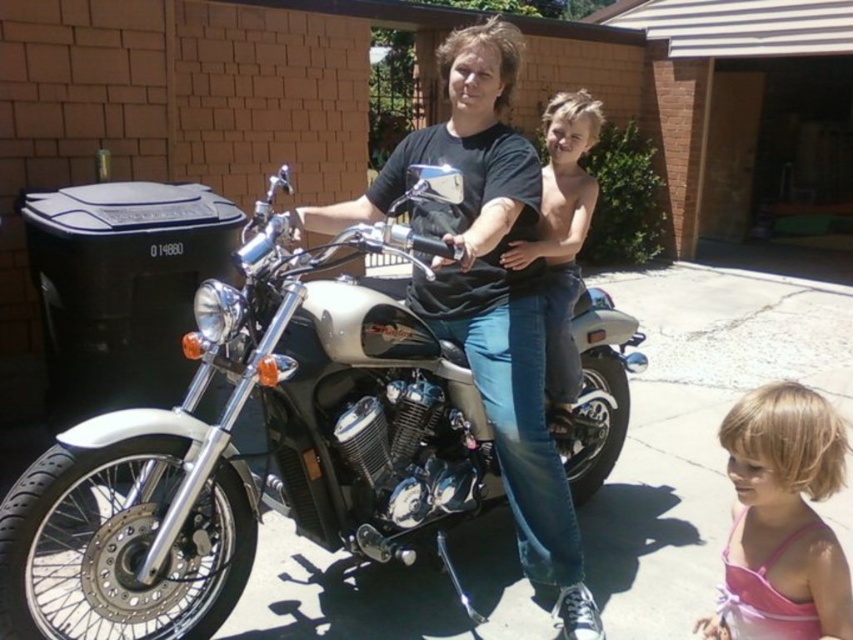
Does white metallic motorcycle at center have a greater width compared to shiny blonde hair at center?

Correct, the width of white metallic motorcycle at center exceeds that of shiny blonde hair at center.

Is white metallic motorcycle at center taller than shiny blonde hair at center?

Indeed, white metallic motorcycle at center has a greater height compared to shiny blonde hair at center.

Image resolution: width=853 pixels, height=640 pixels. What are the coordinates of `white metallic motorcycle at center` in the screenshot? It's located at (265, 444).

At what (x,y) coordinates should I click in order to perform the action: click on white metallic motorcycle at center. Please return your answer as a coordinate pair (x, y). Looking at the image, I should click on (265, 444).

Between black matte shirt at center and pink fabric dress at lower right, which one appears on the right side from the viewer's perspective?

pink fabric dress at lower right

Locate an element on the screen. black matte shirt at center is located at coordinates (489, 296).

What do you see at coordinates (489, 296) in the screenshot?
I see `black matte shirt at center` at bounding box center [489, 296].

You are a GUI agent. You are given a task and a screenshot of the screen. Output one action in this format:
    pyautogui.click(x=<x>, y=<y>)
    Task: Click on the black matte shirt at center
    This screenshot has width=853, height=640.
    Given the screenshot: What is the action you would take?
    pyautogui.click(x=489, y=296)

Which is more to the left, white metallic motorcycle at center or pink fabric dress at lower right?

From the viewer's perspective, white metallic motorcycle at center appears more on the left side.

Between white metallic motorcycle at center and pink fabric dress at lower right, which one is positioned lower?

pink fabric dress at lower right

Describe the element at coordinates (265, 444) in the screenshot. I see `white metallic motorcycle at center` at that location.

Where is `white metallic motorcycle at center`? white metallic motorcycle at center is located at coordinates (265, 444).